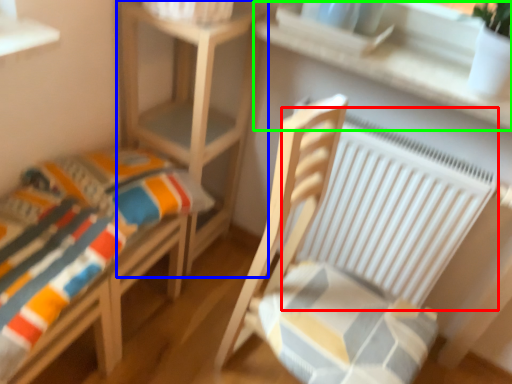
Question: Which is farther away from radiator (highlighted by a red box)? table (highlighted by a blue box) or window sill (highlighted by a green box)?

Choices:
 (A) table
 (B) window sill

Answer: (A)